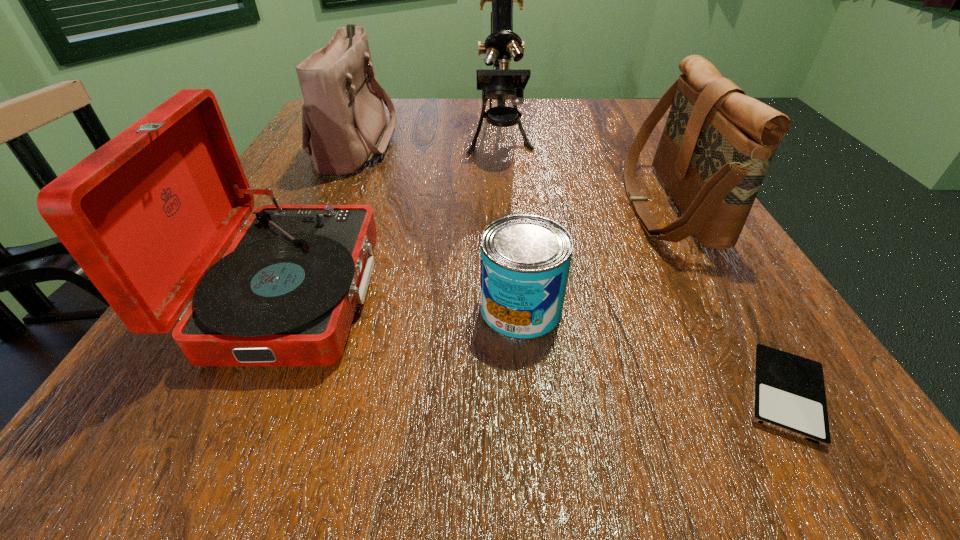
Where is `microscope`? The image size is (960, 540). microscope is located at coordinates coord(501,83).

The width and height of the screenshot is (960, 540). What are the coordinates of `phonograph_record` in the screenshot? It's located at (147, 216).

Identify the location of the right shoulder bag. This screenshot has width=960, height=540. pyautogui.click(x=716, y=146).

Where is `the left shoulder bag`? This screenshot has width=960, height=540. the left shoulder bag is located at coordinates (344, 126).

Locate an element on the screen. the second shortest object is located at coordinates (525, 259).

This screenshot has width=960, height=540. I want to click on iPod, so click(789, 396).

Where is `free space located 0.160m through the eyepiece of the microscope`? free space located 0.160m through the eyepiece of the microscope is located at coordinates (505, 214).

I want to click on blank space located on the front-facing side of the phonograph_record, so click(x=549, y=292).

You are a GUI agent. You are given a task and a screenshot of the screen. Output one action in this format:
    pyautogui.click(x=<x>, y=<y>)
    Task: Click on the free spot located 0.380m on the front-facing side of the right shoulder bag
    
    Given the screenshot: What is the action you would take?
    pyautogui.click(x=416, y=205)

Where is `free region located on the front-facing side of the right shoulder bag`? The image size is (960, 540). free region located on the front-facing side of the right shoulder bag is located at coordinates (550, 205).